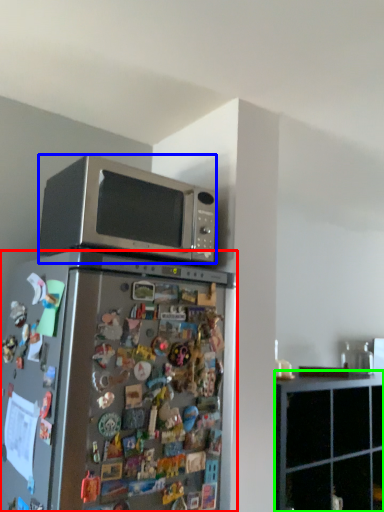
Question: Which object is positioned closest to refrigerator (highlighted by a red box)? Select from microwave oven (highlighted by a blue box) and cabinetry (highlighted by a green box).

Choices:
 (A) microwave oven
 (B) cabinetry

Answer: (A)